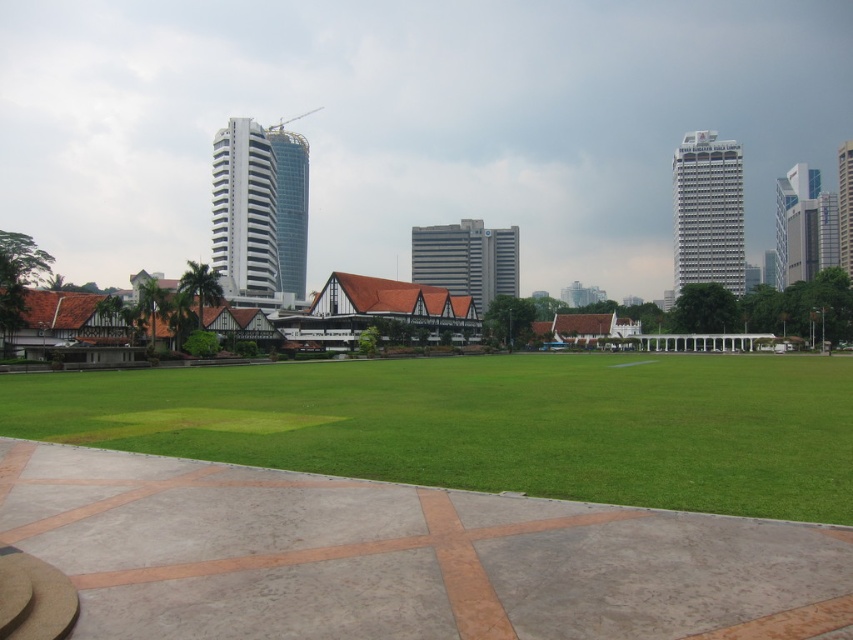
Question: Which point appears closest to the camera in this image?

Choices:
 (A) (218, 240)
 (B) (643, 404)
 (C) (497, 234)
 (D) (711, 253)

Answer: (B)

Question: Which object is farther from the camera taking this photo?

Choices:
 (A) glassy blue tower at center
 (B) green grass at center

Answer: (A)

Question: Considering the relative positions of white glossy building at upper right and glassy modern skyscraper at right in the image provided, where is white glossy building at upper right located with respect to glassy modern skyscraper at right?

Choices:
 (A) below
 (B) above

Answer: (B)

Question: Which of the following is the farthest from the observer?

Choices:
 (A) glassy modern skyscraper at right
 (B) glassy blue tower at center
 (C) white glossy building at upper right
 (D) green grass at center

Answer: (C)

Question: Is gray concrete building at center wider than glassy modern skyscraper at right?

Choices:
 (A) no
 (B) yes

Answer: (A)

Question: Can you confirm if white glossy building at upper left is positioned below gray concrete building at center?

Choices:
 (A) no
 (B) yes

Answer: (A)